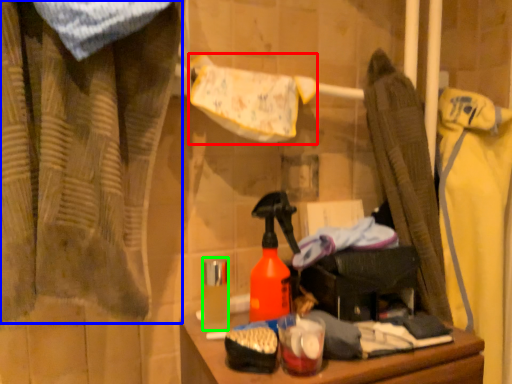
Question: Considering the real-world distances, which object is farthest from bath towel (highlighted by a red box)? curtain (highlighted by a blue box) or toiletry (highlighted by a green box)?

Choices:
 (A) curtain
 (B) toiletry

Answer: (B)